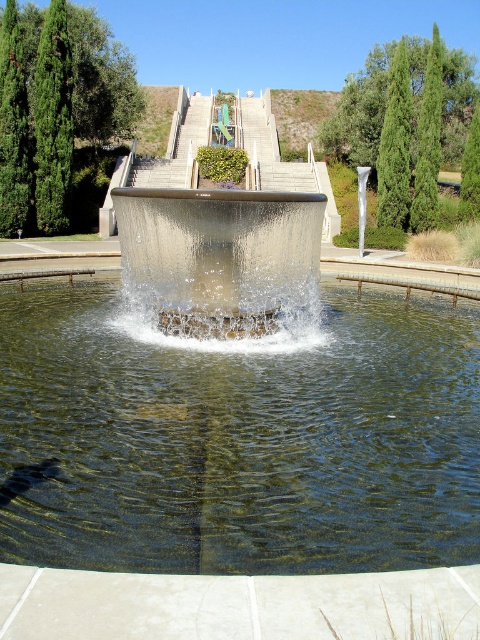
Is the position of clear glass pond at center more distant than that of clear glass water feature at center?

No, clear glass pond at center is in front of clear glass water feature at center.

Which is in front, point (29, 512) or point (177, 221)?

Point (29, 512) is in front.

Locate an element on the screen. This screenshot has width=480, height=640. clear glass pond at center is located at coordinates (238, 438).